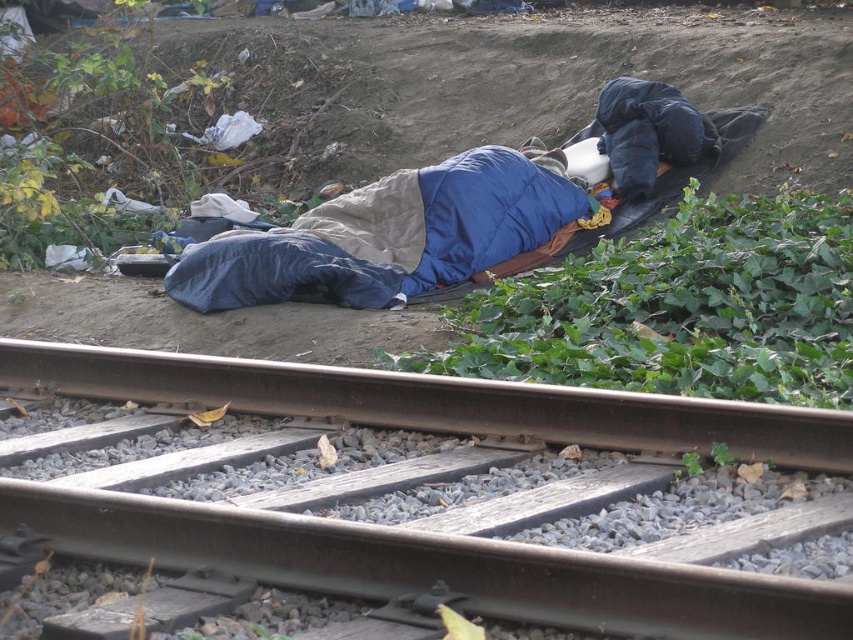
Question: Among these points, which one is nearest to the camera?

Choices:
 (A) (430, 225)
 (B) (720, 412)

Answer: (B)

Question: Does brown metal track at center have a lesser width compared to brushed metal railway line at center?

Choices:
 (A) yes
 (B) no

Answer: (A)

Question: Is blue down jacket at center above brushed metal railway line at center?

Choices:
 (A) yes
 (B) no

Answer: (A)

Question: Which is nearer to the brushed metal railway line at center?

Choices:
 (A) green leafy vegetation at lower right
 (B) blue down jacket at center

Answer: (A)

Question: Which object is the farthest from the blue down jacket at center?

Choices:
 (A) green leafy vegetation at lower right
 (B) brown metal track at center

Answer: (B)

Question: Does green leafy vegetation at lower right have a lesser width compared to blue down jacket at center?

Choices:
 (A) no
 (B) yes

Answer: (A)